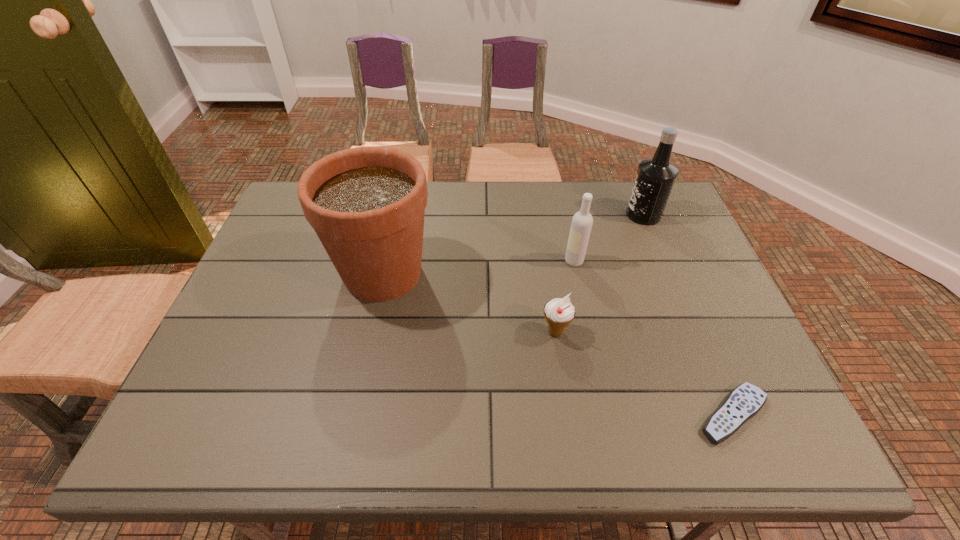
I want to click on vacant region between the farthest object and the shortest object, so click(x=688, y=315).

Find the location of a particular element. The image size is (960, 540). free space between the third tallest object and the leftmost object is located at coordinates click(478, 267).

Locate an element on the screen. vacant space that's between the flowerpot and the second nearest object is located at coordinates (469, 303).

The image size is (960, 540). Identify the location of free space between the farthest object and the leftmost object. (514, 244).

Locate an element on the screen. This screenshot has width=960, height=540. free spot between the third object from left to right and the nearest object is located at coordinates (654, 338).

Image resolution: width=960 pixels, height=540 pixels. What are the coordinates of `free spot between the shortest object and the vodka` in the screenshot? It's located at (654, 338).

The image size is (960, 540). In order to click on free space that is in between the fourth tallest object and the liquor in this screenshot , I will do `click(599, 273)`.

Select which object is the second closest to the remote control. Please provide its 2D coordinates. Your answer should be formatted as a tuple, i.e. [(x, y)], where the tuple contains the x and y coordinates of a point satisfying the conditions above.

[(582, 221)]

Locate an element on the screen. The width and height of the screenshot is (960, 540). the second closest object to the second shortest object is located at coordinates (745, 401).

This screenshot has width=960, height=540. What are the coordinates of `free location that satisfies the following two spatial constraints: 1. on the front label of the remote control; 2. on the right side of the liquor` in the screenshot? It's located at (726, 415).